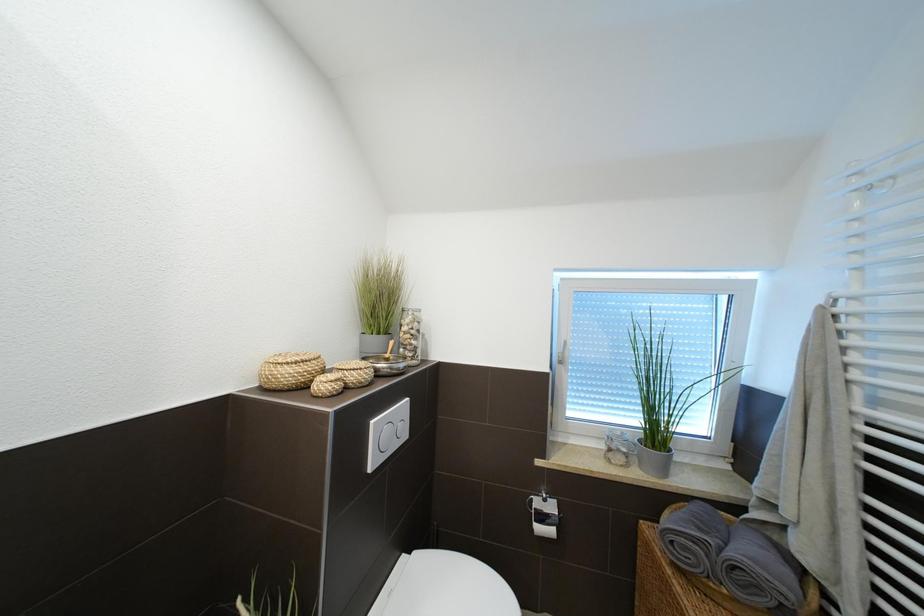
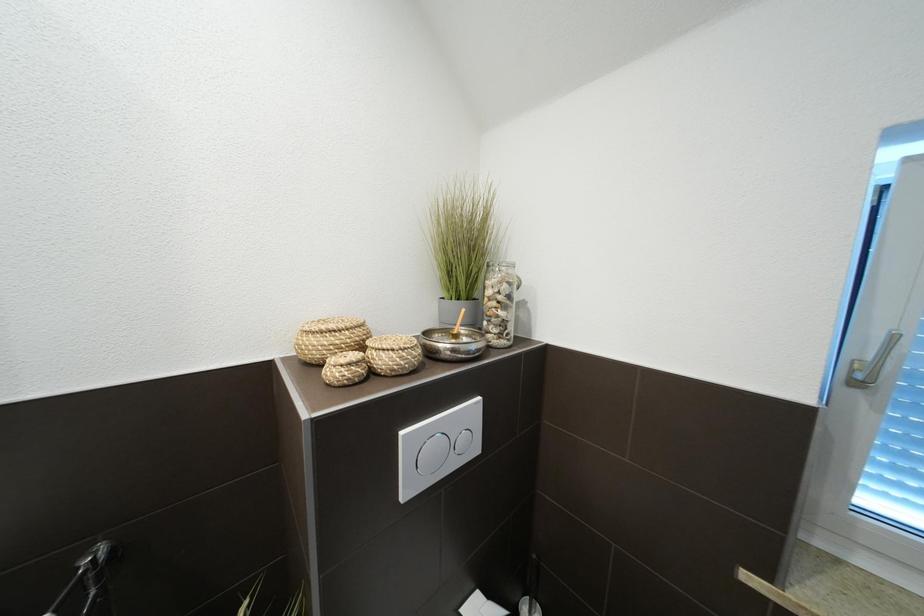
Question: How did the camera likely rotate?

Choices:
 (A) Left
 (B) Right
 (C) Up
 (D) Down

Answer: (A)